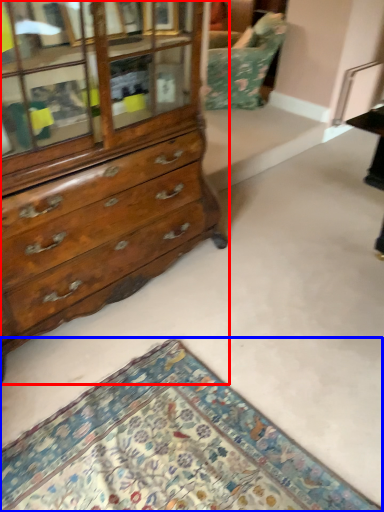
Question: Among these objects, which one is farthest to the camera, chest of drawers (highlighted by a red box) or mat (highlighted by a blue box)?

Choices:
 (A) chest of drawers
 (B) mat

Answer: (A)